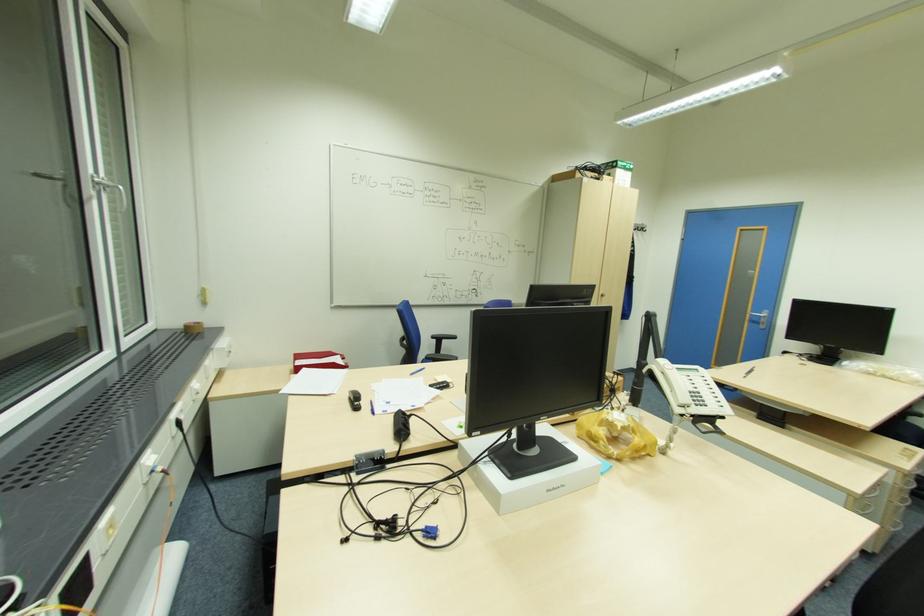
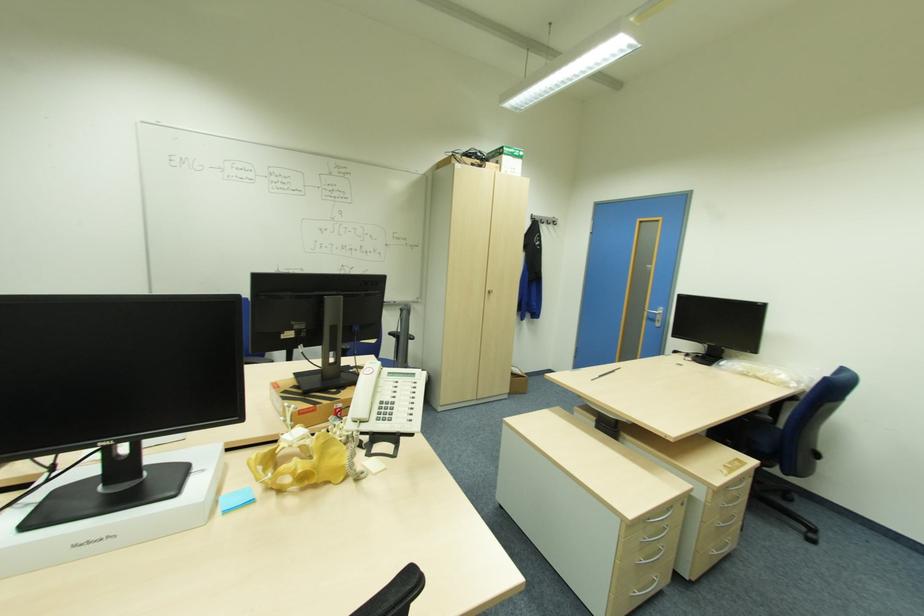
In the second image, find the point that corresponds to (x=766, y=323) in the first image.

(661, 321)